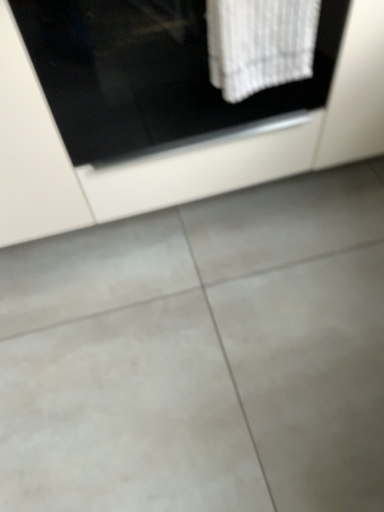
Describe the element at coordinates (176, 149) in the screenshot. The image size is (384, 512). I see `white glossy cabinet at upper center` at that location.

Measure the distance between point (272, 12) and camera.

Point (272, 12) and camera are 29.61 inches apart from each other.

Where is `white glossy cabinet at upper center`? This screenshot has height=512, width=384. white glossy cabinet at upper center is located at coordinates (176, 149).

Is gray tile floor at center oriented away from white textured towel at upper center?

No, white textured towel at upper center is not at the back of gray tile floor at center.

Is point (316, 469) behind point (263, 82)?

That is True.

From the image's perspective, is gray tile floor at center below white textured towel at upper center?

Yes, from the image's perspective, gray tile floor at center is below white textured towel at upper center.

Measure the distance from gray tile floor at center to white glossy cabinet at upper center.

gray tile floor at center is 34.90 centimeters from white glossy cabinet at upper center.

From the image's perspective, which is below, gray tile floor at center or white glossy cabinet at upper center?

gray tile floor at center is shown below in the image.

Looking at this image, is gray tile floor at center far from white glossy cabinet at upper center?

No, there isn't a large distance between gray tile floor at center and white glossy cabinet at upper center.

Considering the sizes of objects white textured towel at upper center and white glossy cabinet at upper center in the image provided, who is taller, white textured towel at upper center or white glossy cabinet at upper center?

Standing taller between the two is white glossy cabinet at upper center.

Can white glossy cabinet at upper center be found inside white textured towel at upper center?

Actually, white glossy cabinet at upper center is outside white textured towel at upper center.

Is point (221, 82) closer to camera compared to point (267, 147)?

Yes, it is.

Is white glossy cabinet at upper center positioned in front of white textured towel at upper center?

That is False.

Which is more to the right, white glossy cabinet at upper center or white textured towel at upper center?

white textured towel at upper center.

Would you say white glossy cabinet at upper center is inside or outside white textured towel at upper center?

white glossy cabinet at upper center is spatially situated outside white textured towel at upper center.

What's the angular difference between white glossy cabinet at upper center and white textured towel at upper center's facing directions?

The angle between the facing direction of white glossy cabinet at upper center and the facing direction of white textured towel at upper center is 0.000192 degrees.

Based on the photo, from the image's perspective, between white textured towel at upper center and gray tile floor at center, which one is located above?

white textured towel at upper center.

Find the location of a particular element. The image size is (384, 512). bath towel in front of the gray tile floor at center is located at coordinates (260, 44).

Which object is positioned more to the left, white textured towel at upper center or gray tile floor at center?

white textured towel at upper center is more to the left.

From a real-world perspective, which object rests below the other?

From a 3D spatial view, gray tile floor at center is below.

Which of these two, white glossy cabinet at upper center or gray tile floor at center, is wider?

Wider between the two is gray tile floor at center.

What's the angular difference between white glossy cabinet at upper center and gray tile floor at center's facing directions?

The angle between the facing direction of white glossy cabinet at upper center and the facing direction of gray tile floor at center is 1.72 degrees.

How far apart are white glossy cabinet at upper center and gray tile floor at center?

white glossy cabinet at upper center and gray tile floor at center are 34.90 centimeters apart from each other.

Who is bigger, white glossy cabinet at upper center or gray tile floor at center?

With larger size is white glossy cabinet at upper center.

Locate an element on the screen. This screenshot has width=384, height=512. concrete below the white textured towel at upper center (from the image's perspective) is located at coordinates click(201, 355).

Where is `concrete located behind the white glossy cabinet at upper center`? Image resolution: width=384 pixels, height=512 pixels. concrete located behind the white glossy cabinet at upper center is located at coordinates (201, 355).

Based on their spatial positions, is white textured towel at upper center or gray tile floor at center closer to white glossy cabinet at upper center?

Among the two, white textured towel at upper center is located nearer to white glossy cabinet at upper center.

Estimate the real-world distances between objects in this image. Which object is further from gray tile floor at center, white glossy cabinet at upper center or white textured towel at upper center?

white textured towel at upper center.

Estimate the real-world distances between objects in this image. Which object is closer to white textured towel at upper center, white glossy cabinet at upper center or gray tile floor at center?

Among the two, white glossy cabinet at upper center is located nearer to white textured towel at upper center.

Based on their spatial positions, is gray tile floor at center or white textured towel at upper center further from white glossy cabinet at upper center?

gray tile floor at center is positioned further to the anchor white glossy cabinet at upper center.

Considering their positions, is gray tile floor at center positioned further to white textured towel at upper center than white glossy cabinet at upper center?

gray tile floor at center is further to white textured towel at upper center.

Estimate the real-world distances between objects in this image. Which object is further from gray tile floor at center, white textured towel at upper center or white glossy cabinet at upper center?

white textured towel at upper center is further to gray tile floor at center.

At what (x,y) coordinates should I click in order to perform the action: click on bath towel between white glossy cabinet at upper center and gray tile floor at center in the up-down direction. Please return your answer as a coordinate pair (x, y). The image size is (384, 512). Looking at the image, I should click on (260, 44).